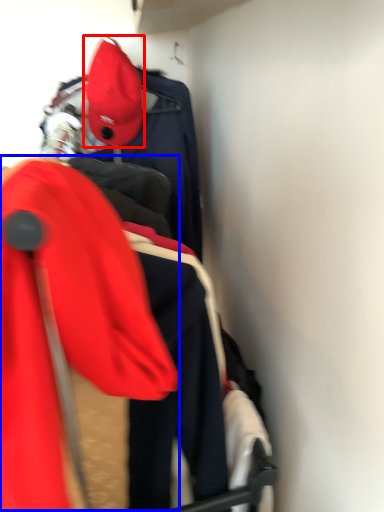
Question: Which point is closer to the camera, hat (highlighted by a red box) or ski jacket (highlighted by a blue box)?

Choices:
 (A) hat
 (B) ski jacket

Answer: (B)